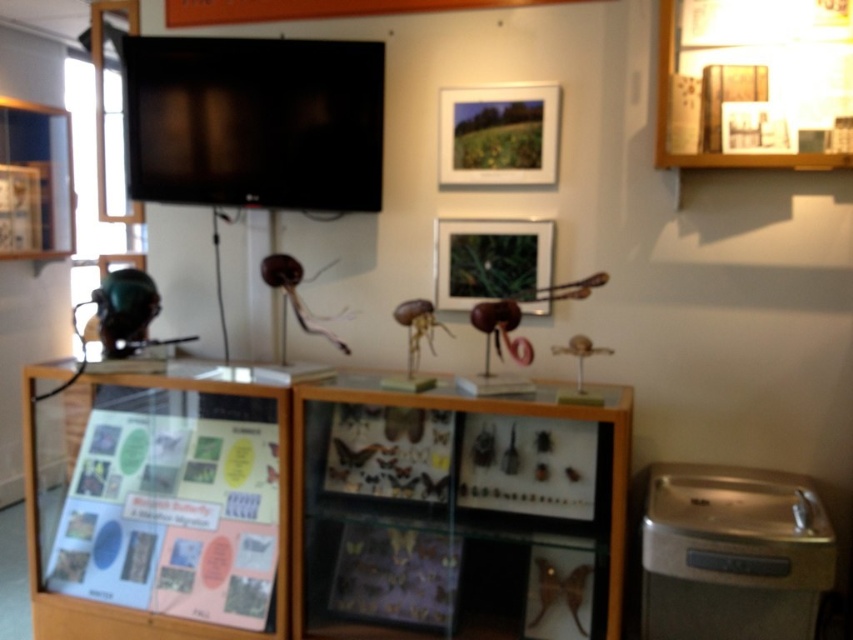
Question: Does wooden frame at upper right have a larger size compared to matte black picture frame at center?

Choices:
 (A) no
 (B) yes

Answer: (B)

Question: Estimate the real-world distances between objects in this image. Which object is farther from the matte wooden picture frame at upper center?

Choices:
 (A) black glossy flat screen tv at upper left
 (B) wooden frame at upper right
 (C) wooden display case at center
 (D) matte black picture frame at center

Answer: (C)

Question: Which object appears farthest from the camera in this image?

Choices:
 (A) wooden display case at center
 (B) wooden frame at upper right
 (C) matte black picture frame at center
 (D) black glossy flat screen tv at upper left

Answer: (C)

Question: Does wooden display case at center have a smaller size compared to wooden frame at upper right?

Choices:
 (A) yes
 (B) no

Answer: (B)

Question: Which point is farther to the camera?

Choices:
 (A) (839, 4)
 (B) (322, 58)
 (C) (503, 132)
 (D) (473, 268)

Answer: (D)

Question: Can you confirm if wooden display case at center is positioned above matte black picture frame at center?

Choices:
 (A) no
 (B) yes

Answer: (A)